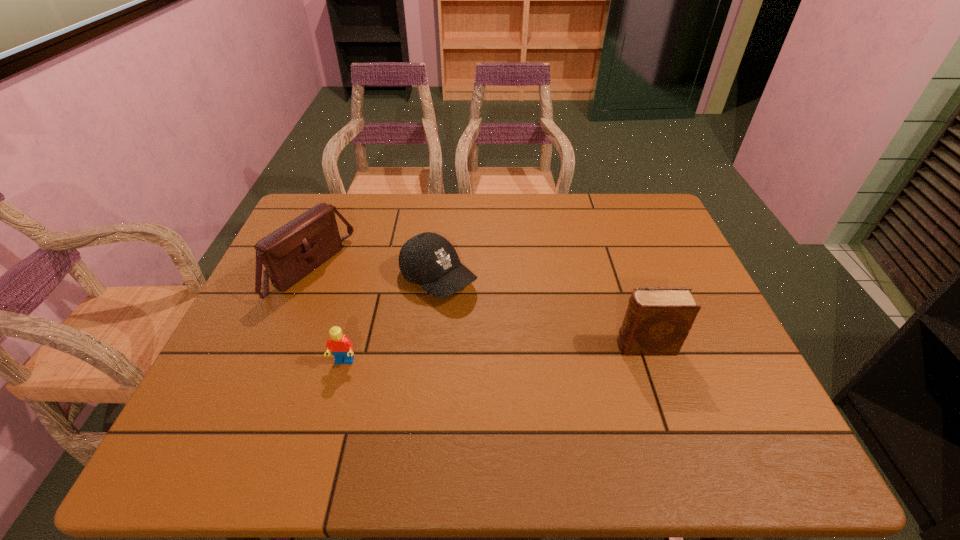
Where is `the second object from left to right`? The height and width of the screenshot is (540, 960). the second object from left to right is located at coordinates (342, 348).

I want to click on diary, so click(657, 321).

Identify the location of shoulder bag. This screenshot has width=960, height=540. (291, 252).

Find the location of `baseball cap`. baseball cap is located at coordinates (428, 259).

You are a GUI agent. You are given a task and a screenshot of the screen. Output one action in this format:
    pyautogui.click(x=<x>, y=<y>)
    Task: Click on the free space located on the face of the Lego
    The image size is (960, 540).
    Given the screenshot: What is the action you would take?
    tap(330, 412)

Locate an element on the screen. vacant space situated 0.140m on the spine side of the rightmost object is located at coordinates (558, 346).

Where is `free space located on the spine side of the rightmost object`? This screenshot has height=540, width=960. free space located on the spine side of the rightmost object is located at coordinates (487, 346).

Where is `free region located 0.210m on the spine side of the rightmost object`? This screenshot has height=540, width=960. free region located 0.210m on the spine side of the rightmost object is located at coordinates (528, 346).

At what (x,y) coordinates should I click in order to perform the action: click on vacant area situated 0.390m on the front flap of the leftmost object. Please return your answer as a coordinate pair (x, y). This screenshot has height=540, width=960. Looking at the image, I should click on (453, 346).

I want to click on free space located on the front flap of the leftmost object, so click(x=446, y=343).